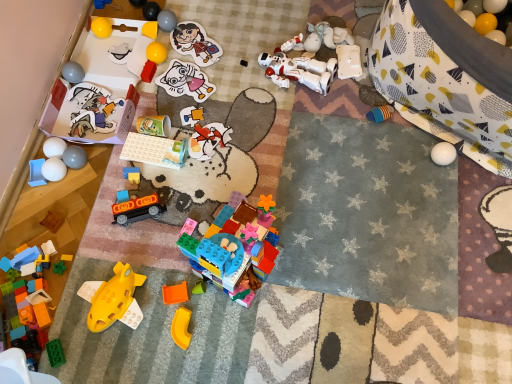
Image resolution: width=512 pixels, height=384 pixels. Find the location of `free space that is in between matte paper sticker at upper center, which is counted as the twentieth toy, starting from the left, and orange matte train at center, placed as the 14th toy when sorted from left to right`. free space that is in between matte paper sticker at upper center, which is counted as the twentieth toy, starting from the left, and orange matte train at center, placed as the 14th toy when sorted from left to right is located at coordinates (173, 115).